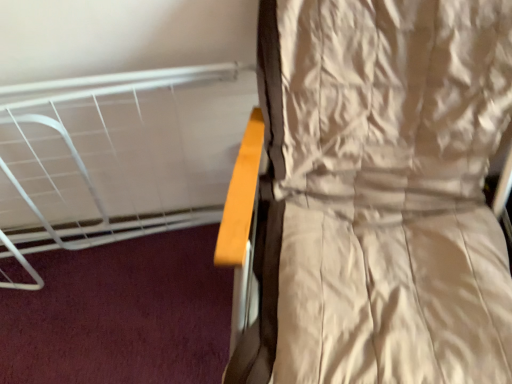
The image size is (512, 384). Describe the element at coordinates (381, 194) in the screenshot. I see `beige satin curtain at right` at that location.

You are a GUI agent. You are given a task and a screenshot of the screen. Output one action in this format:
    pyautogui.click(x=<x>, y=<y>)
    Task: Click on the beige satin curtain at right
    
    Given the screenshot: What is the action you would take?
    pyautogui.click(x=381, y=194)

The height and width of the screenshot is (384, 512). I want to click on white matte bed at upper left, so click(x=116, y=156).

What do you see at coordinates (116, 156) in the screenshot? The image size is (512, 384). I see `white matte bed at upper left` at bounding box center [116, 156].

What is the approximate height of white matte bed at upper left?

white matte bed at upper left is 21.40 inches in height.

Find the location of `beige satin curtain at right`. beige satin curtain at right is located at coordinates (381, 194).

Between white matte bed at upper left and beige satin curtain at right, which one appears on the left side from the viewer's perspective?

white matte bed at upper left is more to the left.

Which object is closer to the camera, white matte bed at upper left or beige satin curtain at right?

beige satin curtain at right is in front.

Does point (51, 185) come closer to viewer compared to point (457, 186)?

No.

From the image's perspective, is white matte bed at upper left above or below beige satin curtain at right?

From the image's perspective, white matte bed at upper left appears above beige satin curtain at right.

From a real-world perspective, is white matte bed at upper left on top of beige satin curtain at right?

No.

Is white matte bed at upper left wider or thinner than beige satin curtain at right?

In the image, white matte bed at upper left appears to be more narrow than beige satin curtain at right.

Who is taller, white matte bed at upper left or beige satin curtain at right?

With more height is beige satin curtain at right.

Does white matte bed at upper left have a smaller size compared to beige satin curtain at right?

Indeed, white matte bed at upper left has a smaller size compared to beige satin curtain at right.

Is white matte bed at upper left surrounding beige satin curtain at right?

That's incorrect, beige satin curtain at right is not inside white matte bed at upper left.

Is white matte bed at upper left not near beige satin curtain at right?

No, white matte bed at upper left is not far away from beige satin curtain at right.

Is white matte bed at upper left positioned with its back to beige satin curtain at right?

white matte bed at upper left does not have its back to beige satin curtain at right.

Locate an element on the screen. curtain on the right of white matte bed at upper left is located at coordinates (381, 194).

Consider the image. Is beige satin curtain at right to the left or to the right of white matte bed at upper left in the image?

beige satin curtain at right is positioned on white matte bed at upper left's right side.

Does beige satin curtain at right lie behind white matte bed at upper left?

No.

Does point (429, 381) appear closer or farther from the camera than point (7, 203)?

Clearly, point (429, 381) is closer to the camera than point (7, 203).

From the image's perspective, who appears lower, beige satin curtain at right or white matte bed at upper left?

beige satin curtain at right.

From a real-world perspective, who is located higher, beige satin curtain at right or white matte bed at upper left?

beige satin curtain at right is physically above.

Consider the image. Which object is wider, beige satin curtain at right or white matte bed at upper left?

Wider between the two is beige satin curtain at right.

Considering the sizes of objects beige satin curtain at right and white matte bed at upper left in the image provided, who is taller, beige satin curtain at right or white matte bed at upper left?

Standing taller between the two is beige satin curtain at right.

Based on their sizes in the image, would you say beige satin curtain at right is bigger or smaller than white matte bed at upper left?

beige satin curtain at right is bigger than white matte bed at upper left.

Do you think beige satin curtain at right is within white matte bed at upper left, or outside of it?

beige satin curtain at right cannot be found inside white matte bed at upper left.

In the scene shown: Is beige satin curtain at right not close to white matte bed at upper left?

No, beige satin curtain at right is in close proximity to white matte bed at upper left.

Is beige satin curtain at right facing towards white matte bed at upper left?

No.

The height and width of the screenshot is (384, 512). Find the location of `bed below the beige satin curtain at right (from a real-world perspective)`. bed below the beige satin curtain at right (from a real-world perspective) is located at coordinates (116, 156).

At what (x,y) coordinates should I click in order to perform the action: click on bed that is above the beige satin curtain at right (from the image's perspective). Please return your answer as a coordinate pair (x, y). The width and height of the screenshot is (512, 384). Looking at the image, I should click on (116, 156).

The image size is (512, 384). I want to click on bed located on the left of beige satin curtain at right, so click(116, 156).